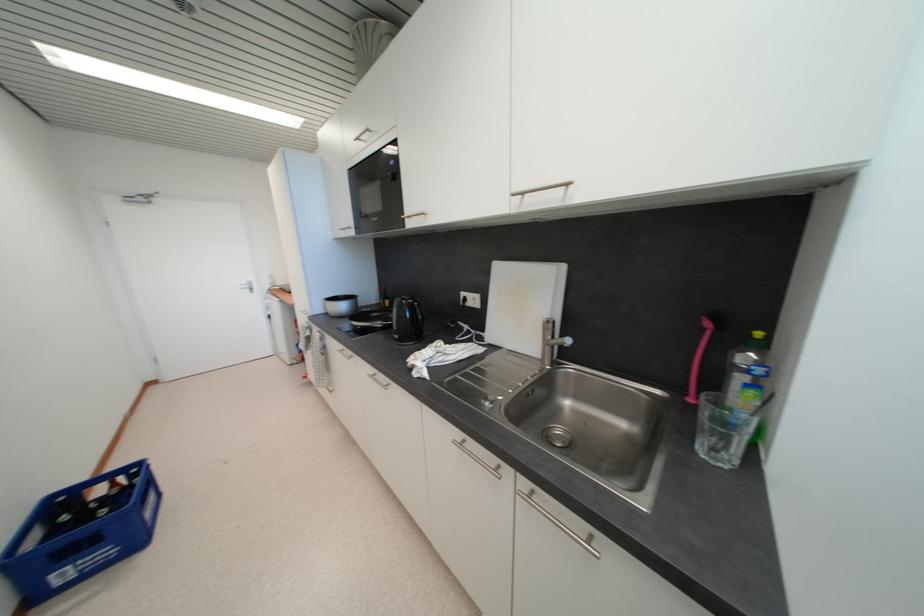
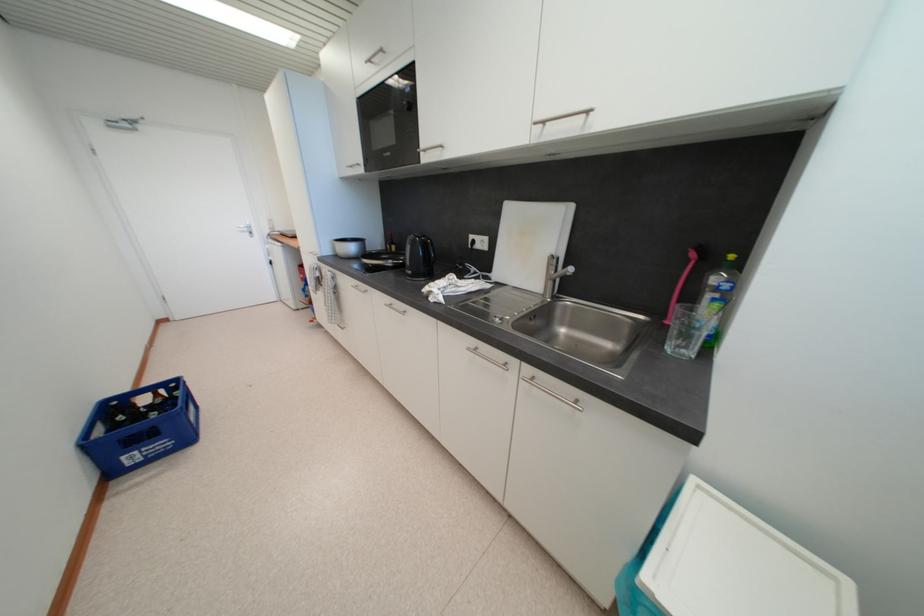
Where in the second image is the point corresponding to point (68, 578) from the first image?

(138, 460)